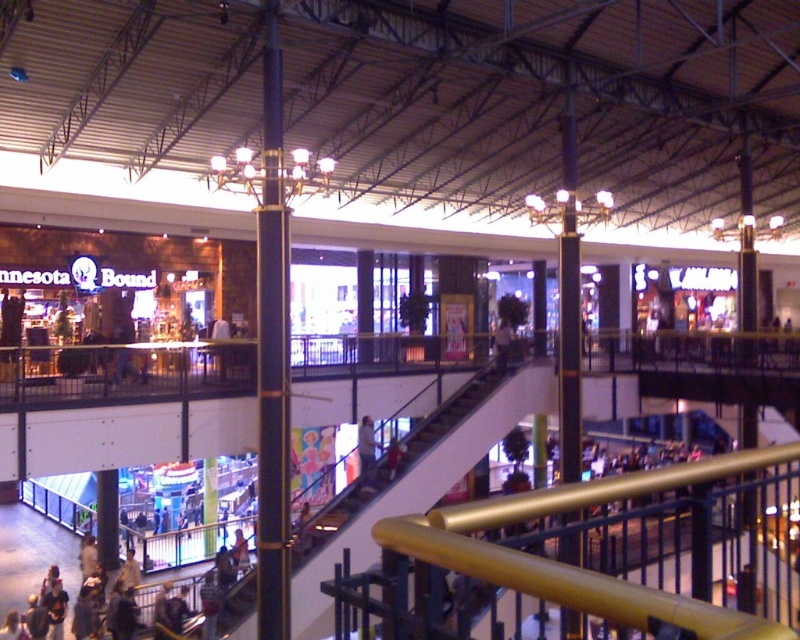
In the scene shown: Does white plastic escalator at center have a greater width compared to light blue jeans at center?

Yes.

Who is positioned more to the right, white plastic escalator at center or light blue jeans at center?

From the viewer's perspective, white plastic escalator at center appears more on the right side.

You are a GUI agent. You are given a task and a screenshot of the screen. Output one action in this format:
    pyautogui.click(x=<x>, y=<y>)
    Task: Click on the white plastic escalator at center
    The width and height of the screenshot is (800, 640).
    Given the screenshot: What is the action you would take?
    pyautogui.click(x=405, y=481)

Locate an element on the screen. white plastic escalator at center is located at coordinates (405, 481).